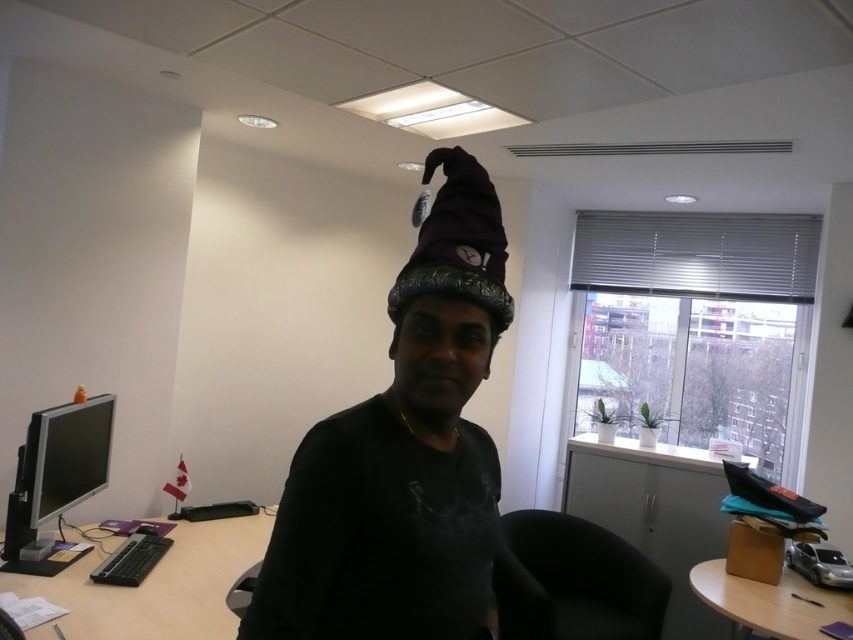
Question: Can you confirm if velvet-like wizard hat at center is positioned above brown cardboard box at lower right?

Choices:
 (A) no
 (B) yes

Answer: (B)

Question: Estimate the real-world distances between objects in this image. Which object is farther from the velvet-like wizard hat at center?

Choices:
 (A) black plastic computer desk at lower left
 (B) matte purple wizard hat at center
 (C) brown cardboard box at lower right
 (D) matte black monitor at left

Answer: (C)

Question: Does matte purple wizard hat at center appear under velvet-like wizard hat at center?

Choices:
 (A) yes
 (B) no

Answer: (A)

Question: Which point is closer to the camera?

Choices:
 (A) (260, 556)
 (B) (503, 308)

Answer: (B)

Question: Among these objects, which one is farthest from the camera?

Choices:
 (A) velvet-like wizard hat at center
 (B) matte black monitor at left
 (C) black plastic computer desk at lower left

Answer: (B)

Question: Is velvet-like wizard hat at center bigger than brown cardboard box at lower right?

Choices:
 (A) no
 (B) yes

Answer: (A)